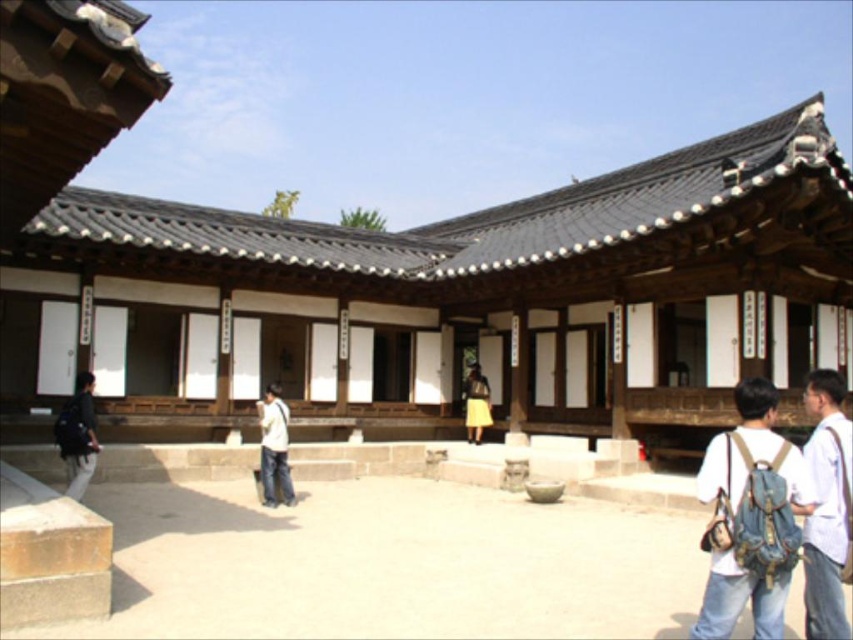
Is denim backpack at lower right bigger than white cotton shirt at lower right?

Indeed, denim backpack at lower right has a larger size compared to white cotton shirt at lower right.

Which of these two, denim backpack at lower right or white cotton shirt at lower right, stands shorter?

Standing shorter between the two is denim backpack at lower right.

This screenshot has height=640, width=853. Describe the element at coordinates (770, 520) in the screenshot. I see `denim backpack at lower right` at that location.

Find the location of `denim backpack at lower right`. denim backpack at lower right is located at coordinates (770, 520).

Does white cotton shirt at lower right have a greater width compared to dark gray backpack at lower left?

Correct, the width of white cotton shirt at lower right exceeds that of dark gray backpack at lower left.

The image size is (853, 640). What do you see at coordinates (827, 506) in the screenshot?
I see `white cotton shirt at lower right` at bounding box center [827, 506].

Locate an element on the screen. white cotton shirt at lower right is located at coordinates (827, 506).

Does point (839, 394) come closer to viewer compared to point (264, 497)?

Yes, it is in front of point (264, 497).

Does white cotton shirt at lower right have a greater height compared to denim jeans at center?

Correct, white cotton shirt at lower right is much taller as denim jeans at center.

You are a GUI agent. You are given a task and a screenshot of the screen. Output one action in this format:
    pyautogui.click(x=<x>, y=<y>)
    Task: Click on the white cotton shirt at lower right
    
    Given the screenshot: What is the action you would take?
    pyautogui.click(x=827, y=506)